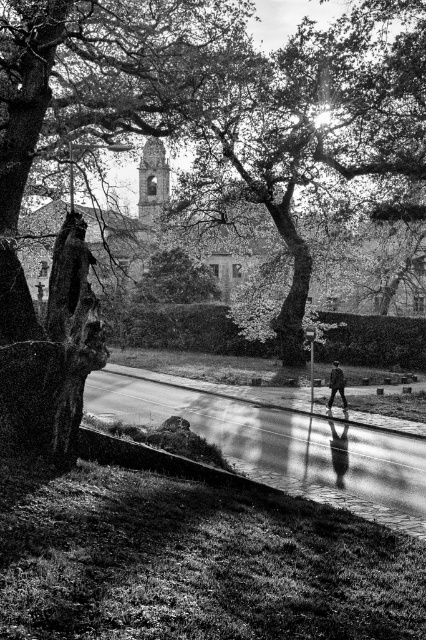
Question: Which object is positioned farthest from the smooth bark tree at center?

Choices:
 (A) smooth bark tree at upper center
 (B) dark gray fabric jacket at center

Answer: (B)

Question: Does smooth asphalt pavement at center come behind dark gray fabric jacket at center?

Choices:
 (A) no
 (B) yes

Answer: (A)

Question: Based on their relative distances, which object is nearer to the smooth bark tree at center?

Choices:
 (A) smooth asphalt pavement at center
 (B) smooth bark tree at upper center
 (C) dark gray fabric jacket at center

Answer: (B)

Question: Does smooth asphalt pavement at center have a smaller size compared to dark gray fabric jacket at center?

Choices:
 (A) no
 (B) yes

Answer: (A)

Question: Which object is farther from the camera taking this photo?

Choices:
 (A) smooth bark tree at center
 (B) smooth asphalt pavement at center
 (C) smooth bark tree at upper center
 (D) dark gray fabric jacket at center

Answer: (D)

Question: Considering the relative positions of smooth bark tree at center and dark gray fabric jacket at center in the image provided, where is smooth bark tree at center located with respect to dark gray fabric jacket at center?

Choices:
 (A) right
 (B) left

Answer: (B)